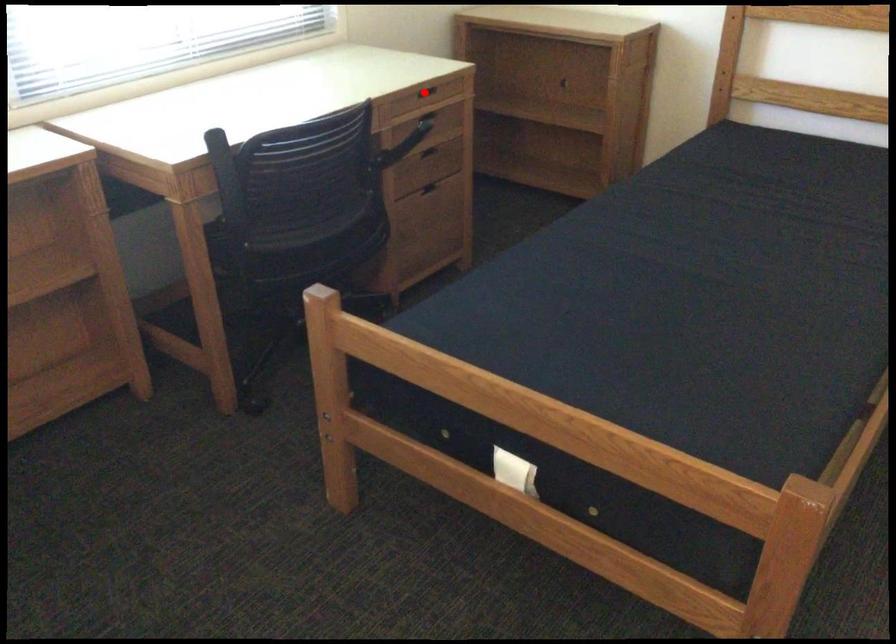
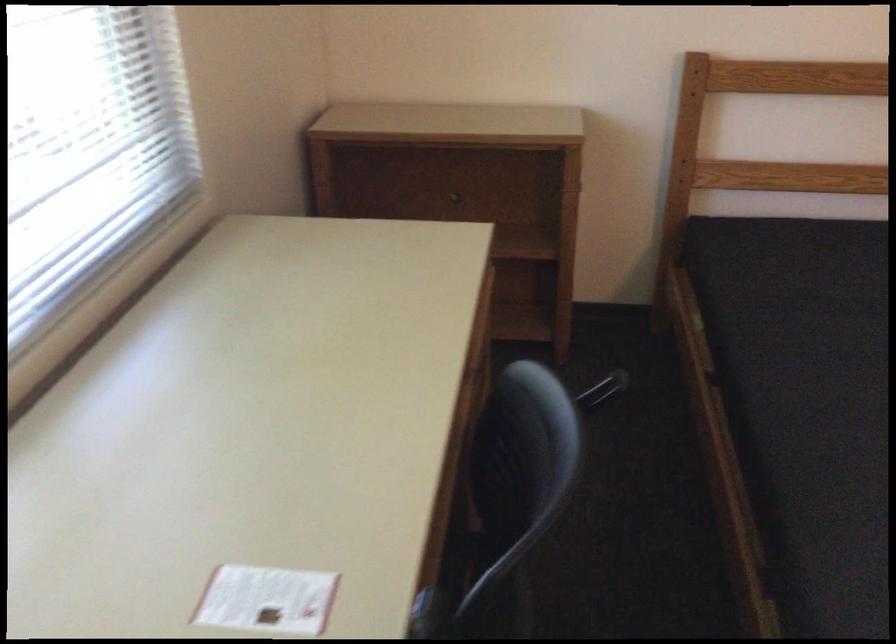
Question: I am providing you with two images of the same scene from different viewpoints. A red point is marked on the first image. Can you still see the location of the red point in image 2?

Choices:
 (A) Yes
 (B) No

Answer: (B)